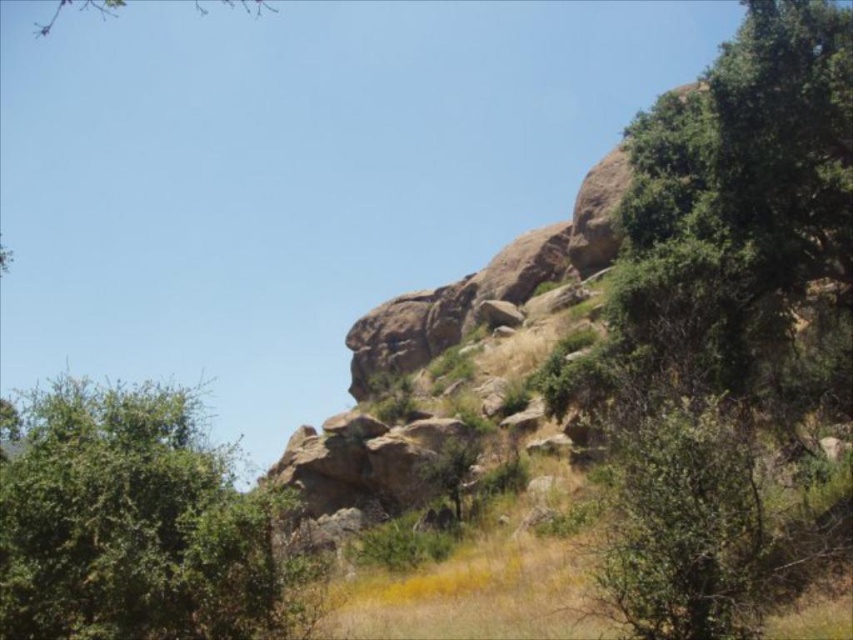
Question: Which point appears closest to the camera in this image?

Choices:
 (A) (196, 1)
 (B) (27, 481)

Answer: (B)

Question: Is green leafy tree at upper right positioned at the back of green leafy bush at left?

Choices:
 (A) no
 (B) yes

Answer: (B)

Question: Is green leafy tree at upper right to the left of green leafy bush at left from the viewer's perspective?

Choices:
 (A) yes
 (B) no

Answer: (B)

Question: Is green leafy tree at upper right below green leafy bush at left?

Choices:
 (A) no
 (B) yes

Answer: (A)

Question: Which point is closer to the camera?

Choices:
 (A) (764, 186)
 (B) (57, 10)

Answer: (A)

Question: Which object is farther from the camera taking this photo?

Choices:
 (A) green leafy bush at left
 (B) green leafy tree at upper right

Answer: (B)